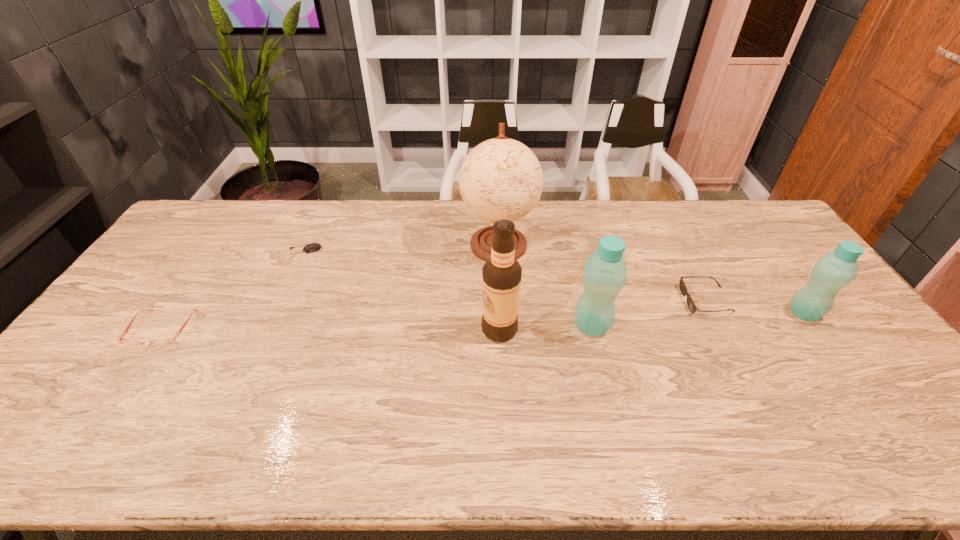
You are a GUI agent. You are given a task and a screenshot of the screen. Output one action in this format:
    pyautogui.click(x=<x>, y=<y>)
    Task: Click on the left bottle
    
    Given the screenshot: What is the action you would take?
    pyautogui.click(x=605, y=273)

Locate an element on the screen. The height and width of the screenshot is (540, 960). the third tallest object is located at coordinates (605, 273).

At what (x,y) coordinates should I click in order to perform the action: click on the rightmost object. Please return your answer as a coordinate pair (x, y). The image size is (960, 540). Looking at the image, I should click on [x=832, y=272].

Find the location of a particular element. The image size is (960, 540). the fourth shortest object is located at coordinates (832, 272).

Where is `globe`? This screenshot has width=960, height=540. globe is located at coordinates (501, 178).

This screenshot has width=960, height=540. Identify the location of the second object from left to right. (313, 247).

In order to click on mouse in this screenshot , I will do [x=313, y=247].

This screenshot has width=960, height=540. I want to click on alcohol, so click(501, 274).

This screenshot has width=960, height=540. Identify the location of the second object from right to left. (683, 289).

Where is `spectacles`? spectacles is located at coordinates (155, 343).